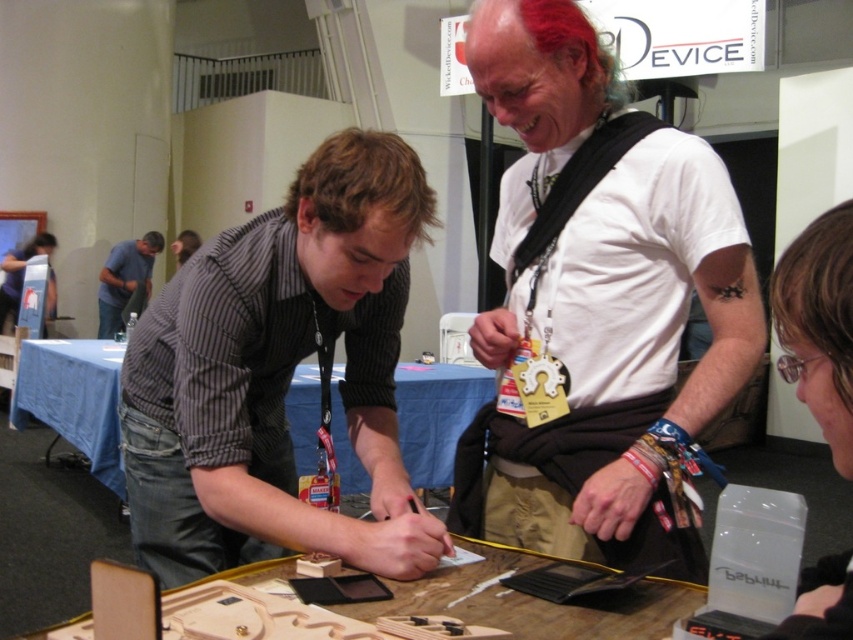
Between point (16, 316) and point (192, 234), which one is positioned behind?

Positioned behind is point (192, 234).

Can you confirm if brushed metal water at bottle left is smaller than smooth black shirt at center?

Yes, brushed metal water at bottle left is smaller than smooth black shirt at center.

I want to click on brushed metal water at bottle left, so click(18, 276).

Locate an element on the screen. brushed metal water at bottle left is located at coordinates (18, 276).

Between white matte shirt at center and striped fabric shirt at center, which one appears on the left side from the viewer's perspective?

Positioned to the left is striped fabric shirt at center.

Who is more distant from viewer, (593, 532) or (281, 515)?

Positioned behind is point (593, 532).

Which is in front, point (503, 474) or point (177, 372)?

Point (177, 372) is more forward.

Find the location of `white matte shirt at center`. white matte shirt at center is located at coordinates (599, 305).

Which of these two, blue fabric table at lower center or brushed metal shirt at left, stands taller?

Standing taller between the two is brushed metal shirt at left.

Is point (100, 451) farther from camera compared to point (134, 260)?

That is False.

Is point (119, 349) more distant than point (149, 240)?

No, it is in front of (149, 240).

Where is `blue fabric table at lower center`? The image size is (853, 640). blue fabric table at lower center is located at coordinates (74, 397).